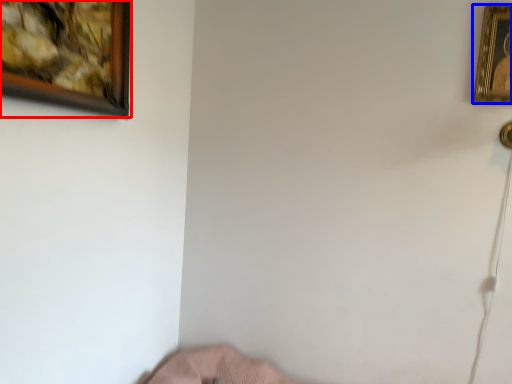
Question: Which of the following is the farthest to the observer, picture frame (highlighted by a red box) or picture frame (highlighted by a blue box)?

Choices:
 (A) picture frame
 (B) picture frame

Answer: (B)